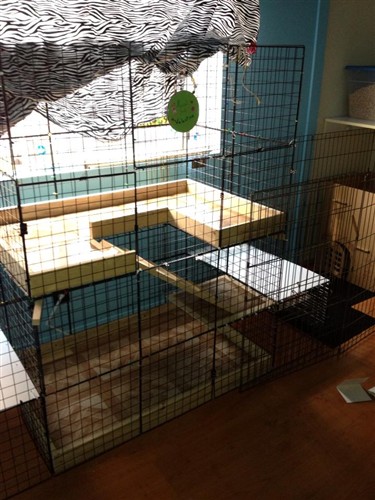
You are a GUI agent. You are given a task and a screenshot of the screen. Output one action in this format:
    pyautogui.click(x=<x>, y=<y>)
    Task: Click on the window
    The height and width of the screenshot is (500, 375).
    Given the screenshot: What is the action you would take?
    pyautogui.click(x=230, y=298), pyautogui.click(x=140, y=149)